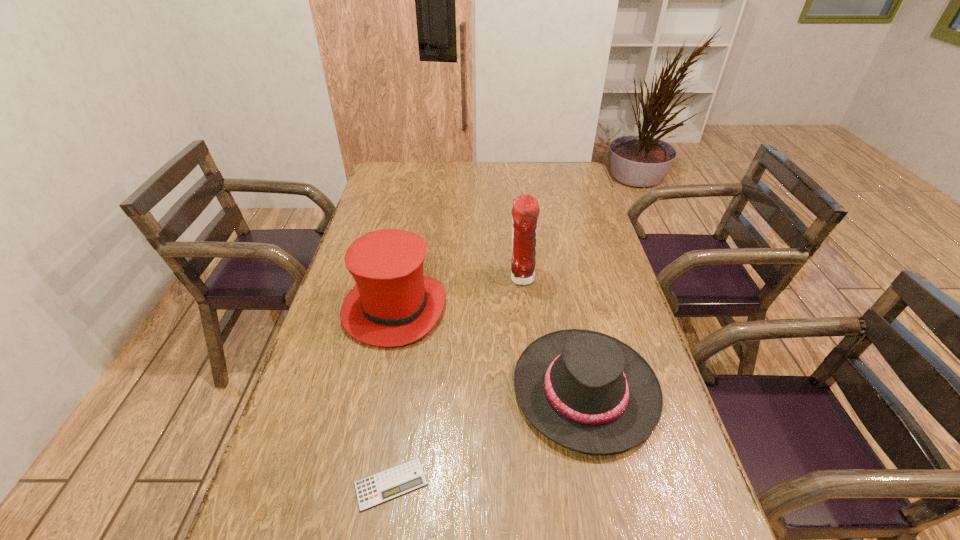
Where is `the tallest object`? Image resolution: width=960 pixels, height=540 pixels. the tallest object is located at coordinates (525, 211).

At what (x,y) coordinates should I click in order to perform the action: click on the left dress hat. Please return your answer as a coordinate pair (x, y). The image size is (960, 540). Looking at the image, I should click on (393, 303).

I want to click on the taller dress hat, so click(x=393, y=303).

The image size is (960, 540). What are the coordinates of `the right dress hat` in the screenshot? It's located at (589, 392).

At what (x,y) coordinates should I click in order to perform the action: click on the second shortest object. Please return your answer as a coordinate pair (x, y). Looking at the image, I should click on (589, 392).

Find the location of `the shortest object`. the shortest object is located at coordinates (384, 486).

Where is `vacant region located on the back of the tallest object`? Image resolution: width=960 pixels, height=540 pixels. vacant region located on the back of the tallest object is located at coordinates (515, 221).

I want to click on free location located on the right of the third shortest object, so click(x=500, y=308).

The image size is (960, 540). I want to click on vacant space positioned on the back of the second shortest object, so pos(561,276).

Find the location of a particular element. The image size is (960, 540). vacant space located 0.050m on the left of the calculator is located at coordinates (329, 484).